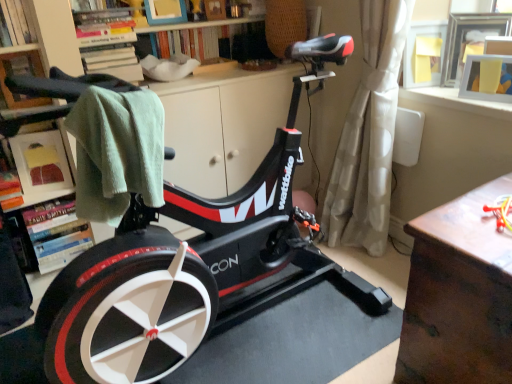
Question: Is black matte stationary bicycle at center positioned behind matte black towel at left, the first shelf from the front?

Choices:
 (A) yes
 (B) no

Answer: (B)

Question: Can you confirm if black matte stationary bicycle at center is shorter than matte black towel at left, the 4th shelf positioned from the back?

Choices:
 (A) no
 (B) yes

Answer: (A)

Question: Can you confirm if black matte stationary bicycle at center is positioned to the left of matte black towel at left, the 4th shelf positioned from the back?

Choices:
 (A) no
 (B) yes

Answer: (A)

Question: From a real-world perspective, is black matte stationary bicycle at center positioned under matte black towel at left, the first shelf from the front, based on gravity?

Choices:
 (A) no
 (B) yes

Answer: (B)

Question: Does black matte stationary bicycle at center appear on the right side of matte black towel at left, the 4th shelf positioned from the back?

Choices:
 (A) no
 (B) yes

Answer: (B)

Question: Considering the positions of black matte stationary bicycle at center and wooden picture frame at upper right, the first picture frame viewed from the front, in the image, is black matte stationary bicycle at center bigger or smaller than wooden picture frame at upper right, the first picture frame viewed from the front,?

Choices:
 (A) small
 (B) big

Answer: (B)

Question: From a real-world perspective, is black matte stationary bicycle at center physically located above or below wooden picture frame at upper right, placed as the second picture frame when sorted from back to front?

Choices:
 (A) above
 (B) below

Answer: (B)

Question: Is point (167, 233) closer or farther from the camera than point (506, 91)?

Choices:
 (A) closer
 (B) farther

Answer: (A)

Question: Considering the positions of black matte stationary bicycle at center and wooden picture frame at upper right, placed as the second picture frame when sorted from back to front, in the image, is black matte stationary bicycle at center wider or thinner than wooden picture frame at upper right, placed as the second picture frame when sorted from back to front,?

Choices:
 (A) thin
 (B) wide

Answer: (B)

Question: Would you say wooden bookshelf at upper center, the third shelf when ordered from back to front, is inside or outside brown wooden table at right?

Choices:
 (A) outside
 (B) inside

Answer: (A)

Question: Based on their positions, is wooden bookshelf at upper center, positioned as the 2th shelf in front-to-back order, located to the left or right of brown wooden table at right?

Choices:
 (A) right
 (B) left

Answer: (B)

Question: Is wooden bookshelf at upper center, positioned as the 2th shelf in front-to-back order, in front of or behind brown wooden table at right in the image?

Choices:
 (A) behind
 (B) front

Answer: (A)

Question: From their relative heights in the image, would you say wooden bookshelf at upper center, positioned as the 2th shelf in front-to-back order, is taller or shorter than brown wooden table at right?

Choices:
 (A) short
 (B) tall

Answer: (A)

Question: Is point (475, 89) positioned closer to the camera than point (27, 135)?

Choices:
 (A) farther
 (B) closer

Answer: (B)

Question: Considering the positions of wooden picture frame at upper right, placed as the second picture frame when sorted from back to front, and matte white frame at upper left, which is the second shelf from back to front, in the image, is wooden picture frame at upper right, placed as the second picture frame when sorted from back to front, taller or shorter than matte white frame at upper left, which is the second shelf from back to front,?

Choices:
 (A) short
 (B) tall

Answer: (A)